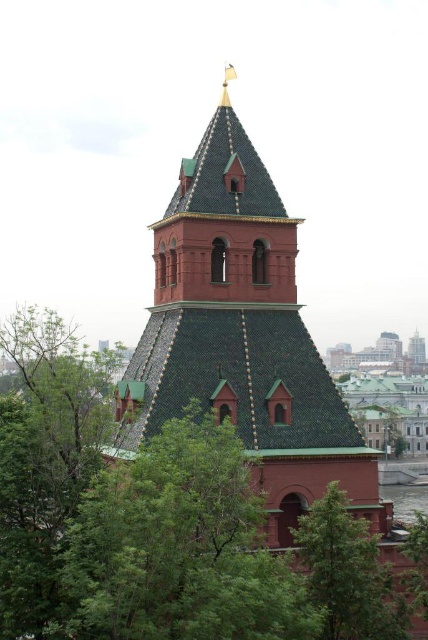
Question: Does green textured leaves at center have a lesser width compared to green tiled tower at center?

Choices:
 (A) yes
 (B) no

Answer: (B)

Question: Is green textured leaves at center wider than green tiled tower at center?

Choices:
 (A) no
 (B) yes

Answer: (B)

Question: Does green textured leaves at center have a smaller size compared to green tiled tower at center?

Choices:
 (A) no
 (B) yes

Answer: (A)